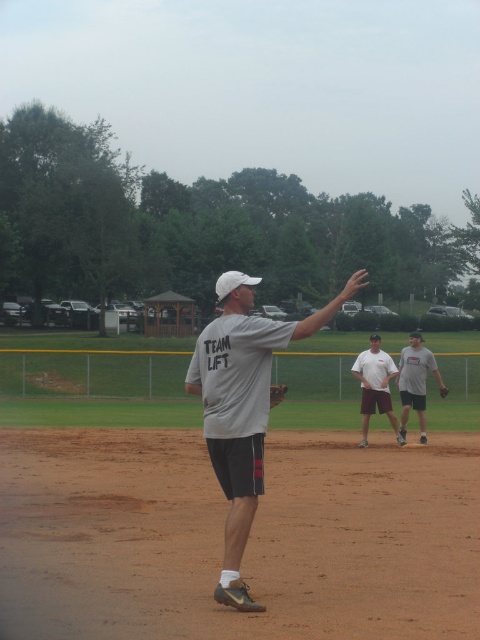
Question: Is gray fabric shirt at center bigger than gray cotton t-shirt at center?

Choices:
 (A) no
 (B) yes

Answer: (B)

Question: Is gray cotton t-shirt at center to the right of brown leather glove at center from the viewer's perspective?

Choices:
 (A) no
 (B) yes

Answer: (A)

Question: Can you confirm if white cotton shirt at center is smaller than brown leather glove at center?

Choices:
 (A) no
 (B) yes

Answer: (A)

Question: Which of the following is the farthest from the observer?

Choices:
 (A) brown dirt field at center
 (B) gray fabric shirt at center

Answer: (B)

Question: Which of the following is the closest to the observer?

Choices:
 (A) brown leather glove at center
 (B) gray cotton t-shirt at center
 (C) white cotton shirt at center

Answer: (C)

Question: Which of the following is the farthest from the observer?

Choices:
 (A) (264, 419)
 (B) (444, 394)
 (C) (365, 445)

Answer: (C)